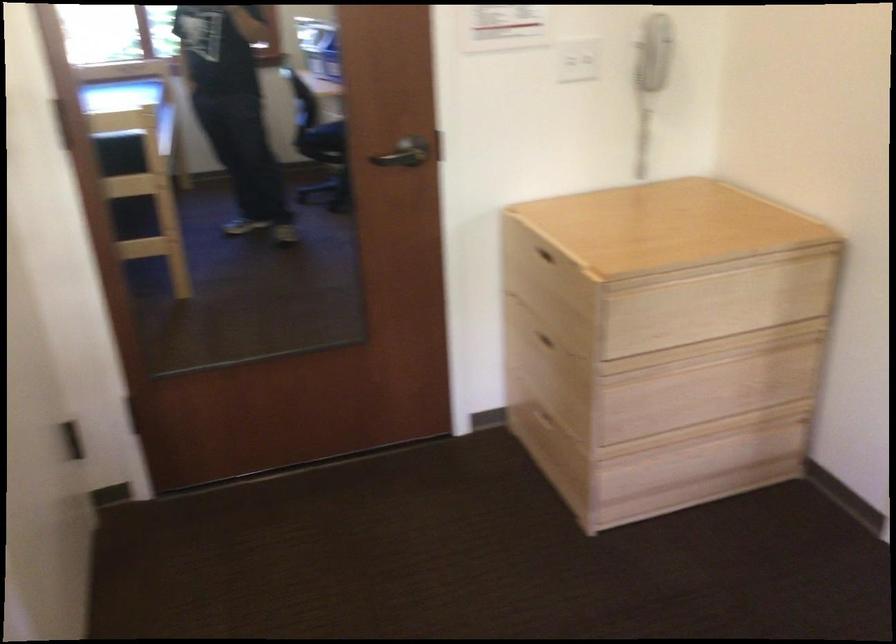
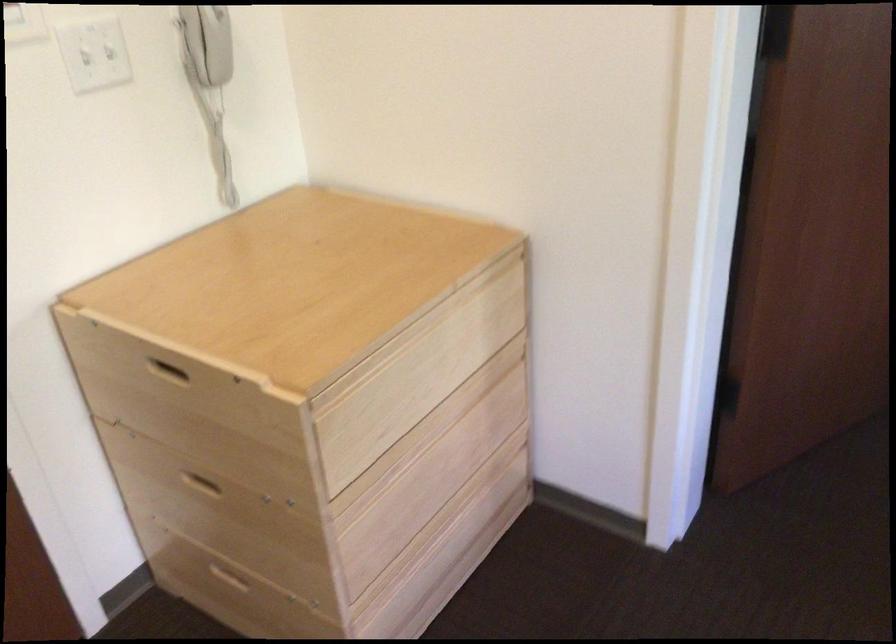
Find the pixel in the second image that matches point 643,84 in the first image.

(210, 82)